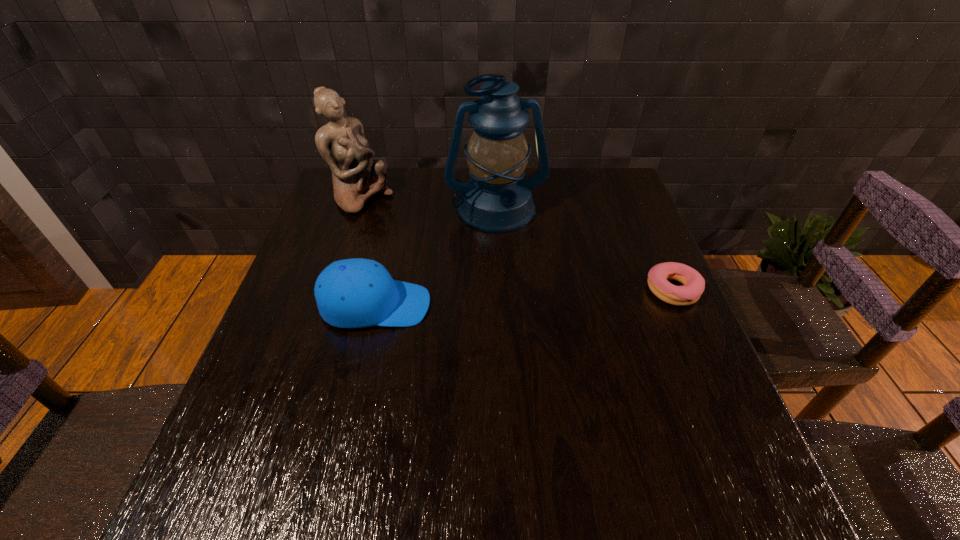
Locate an element on the screen. The height and width of the screenshot is (540, 960). vacant area between the rightmost object and the second shortest object is located at coordinates 524,298.

The image size is (960, 540). Find the location of `vacant space that's between the third object from left to right and the second shortest object`. vacant space that's between the third object from left to right and the second shortest object is located at coordinates click(436, 257).

In order to click on blank region between the figurine and the tallest object in this screenshot , I will do `click(429, 204)`.

At what (x,y) coordinates should I click in order to perform the action: click on free space between the tallest object and the figurine. Please return your answer as a coordinate pair (x, y). The width and height of the screenshot is (960, 540). Looking at the image, I should click on (429, 204).

You are a GUI agent. You are given a task and a screenshot of the screen. Output one action in this format:
    pyautogui.click(x=<x>, y=<y>)
    Task: Click on the object that stands as the closest to the rightmost object
    This screenshot has width=960, height=540.
    Given the screenshot: What is the action you would take?
    pyautogui.click(x=496, y=200)

Choose which object is the third nearest neighbor to the tallest object. Please provide its 2D coordinates. Your answer should be formatted as a tuple, i.e. [(x, y)], where the tuple contains the x and y coordinates of a point satisfying the conditions above.

[(693, 283)]

At what (x,y) coordinates should I click in order to perform the action: click on free location that satisfies the following two spatial constraints: 1. on the front side of the shortest object; 2. on the right side of the lantern. Please return your answer as a coordinate pair (x, y). Looking at the image, I should click on (500, 290).

The width and height of the screenshot is (960, 540). I want to click on free space that satisfies the following two spatial constraints: 1. on the front side of the third shortest object; 2. on the right side of the rightmost object, so click(332, 290).